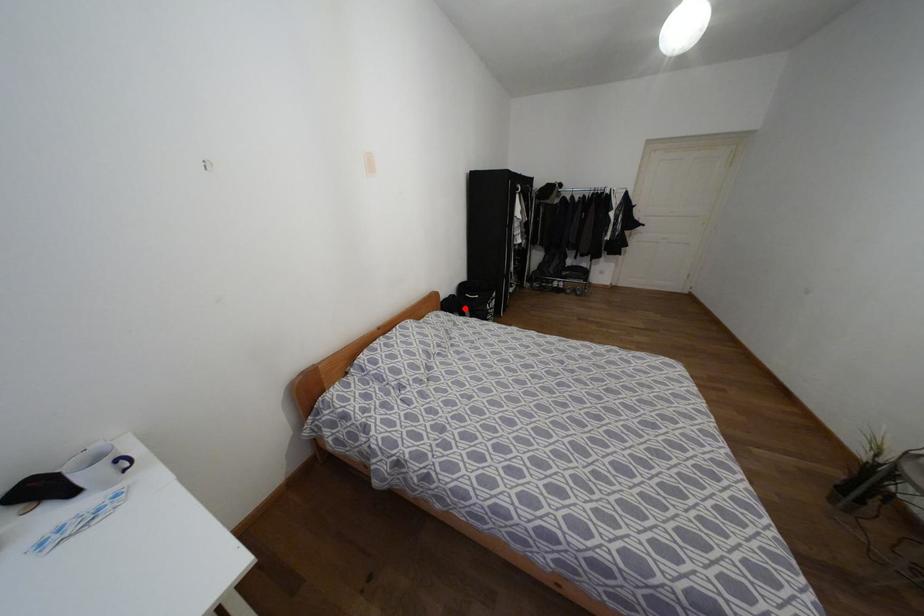
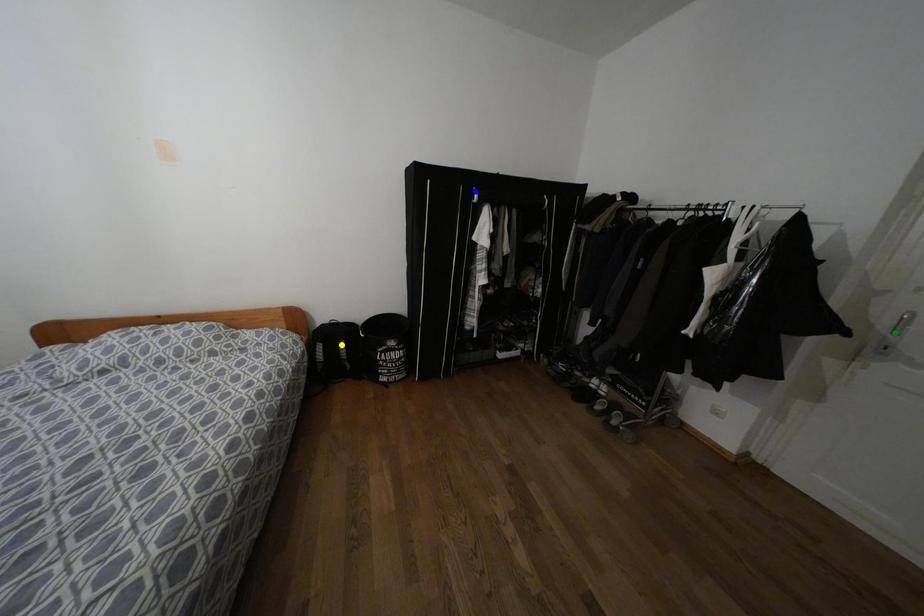
Question: I am providing you with two images of the same scene from different viewpoints. A red point is marked on the first image. You are given multiple points on the second image. Which point in image 2 is actually the same real-world point as the red point in image 1?

Choices:
 (A) yellow point
 (B) blue point
 (C) green point

Answer: (A)